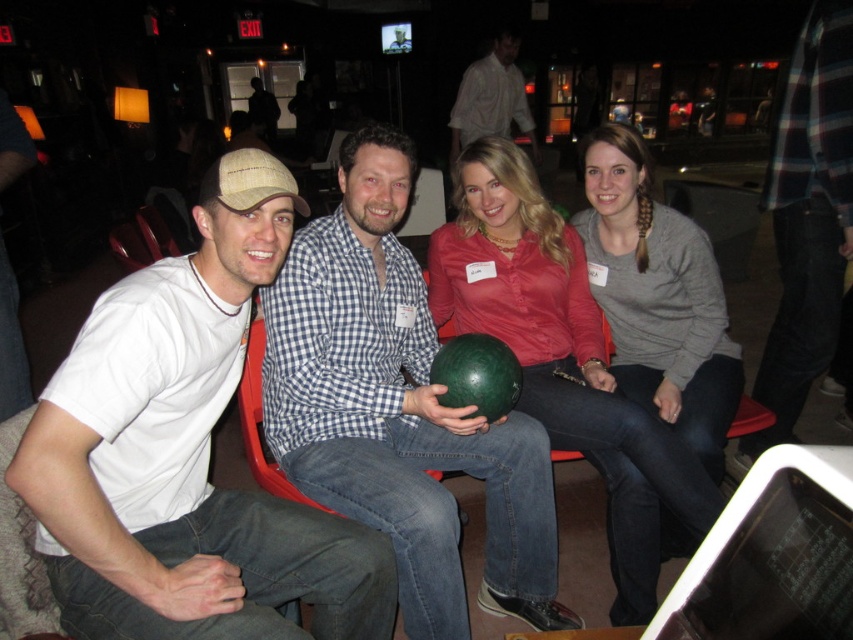
Is point (846, 180) more distant than point (496, 371)?

Yes, it is behind point (496, 371).

Consider the image. Does plaid flannel shirt at right have a smaller size compared to green matte bowling ball at center?

No.

Does point (766, 444) come closer to viewer compared to point (445, 365)?

No, (766, 444) is further to viewer.

In order to click on plaid flannel shirt at right in this screenshot , I will do `click(807, 218)`.

Does gray cotton sweater at center lie behind plaid flannel shirt at right?

No, gray cotton sweater at center is in front of plaid flannel shirt at right.

Can you confirm if gray cotton sweater at center is positioned below plaid flannel shirt at right?

Correct, gray cotton sweater at center is located below plaid flannel shirt at right.

The height and width of the screenshot is (640, 853). I want to click on gray cotton sweater at center, so click(x=659, y=298).

Locate an element on the screen. The image size is (853, 640). gray cotton sweater at center is located at coordinates (659, 298).

Looking at this image, who is taller, plaid flannel shirt at right or white shirt at center?

plaid flannel shirt at right is taller.

Measure the distance between point (775, 356) and camera.

Point (775, 356) is 2.63 meters away from camera.

Does point (799, 113) lie behind point (518, 90)?

No, it is in front of (518, 90).

At what (x,y) coordinates should I click in order to perform the action: click on plaid flannel shirt at right. Please return your answer as a coordinate pair (x, y). The image size is (853, 640). Looking at the image, I should click on (807, 218).